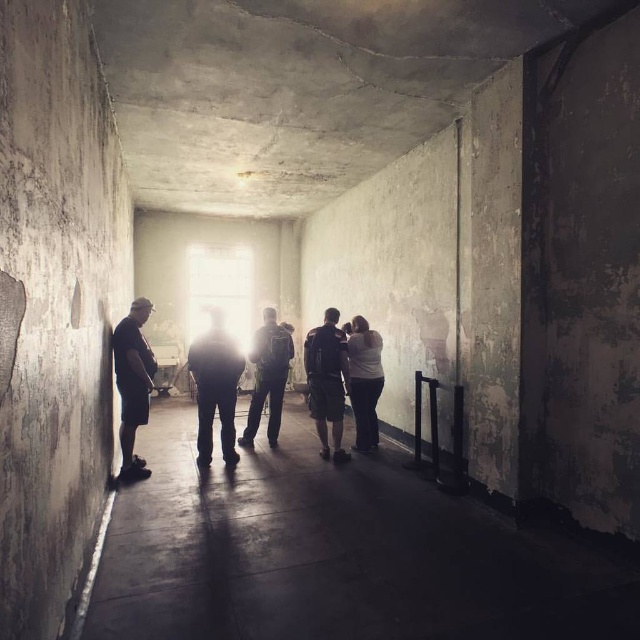
Is point (316, 355) positioned behind point (273, 440)?

No, it is not.

Looking at this image, is dark gray fabric backpack at center wider than matte green backpack at center?

Incorrect, dark gray fabric backpack at center's width does not surpass matte green backpack at center's.

Locate an element on the screen. dark gray fabric backpack at center is located at coordinates (326, 381).

Find the location of `dark gray fabric backpack at center`. dark gray fabric backpack at center is located at coordinates (326, 381).

Can you confirm if dark gray fabric pants at center is wider than dark gray fabric backpack at center?

Yes.

Is point (204, 353) less distant than point (340, 426)?

Yes, point (204, 353) is closer to viewer.

Find the location of `dark gray fabric pants at center`. dark gray fabric pants at center is located at coordinates (216, 387).

Can you confirm if concrete floor at center is positioned to the left of dark gray fabric backpack at center?

In fact, concrete floor at center is to the right of dark gray fabric backpack at center.

Does concrete floor at center lie behind dark gray fabric backpack at center?

No, it is not.

Between point (540, 531) and point (321, 348), which one is positioned behind?

Positioned behind is point (321, 348).

The height and width of the screenshot is (640, 640). What are the coordinates of `concrete floor at center` in the screenshot? It's located at (336, 554).